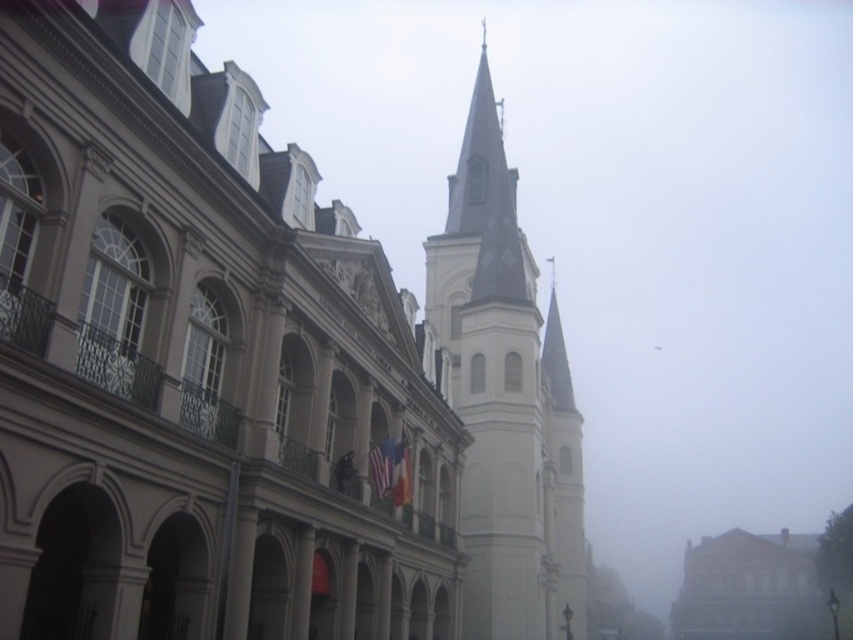
Question: Can you confirm if white stone church at center is smaller than smooth white building at lower right?

Choices:
 (A) yes
 (B) no

Answer: (A)

Question: Does white stone church at center have a smaller size compared to smooth white building at lower right?

Choices:
 (A) yes
 (B) no

Answer: (A)

Question: Based on their relative distances, which object is nearer to the smooth white building at lower right?

Choices:
 (A) white stone church at center
 (B) white stone steeple at center

Answer: (B)

Question: Among these points, which one is farthest from the camera?

Choices:
 (A) (514, 253)
 (B) (100, 337)

Answer: (A)

Question: Is white stone steeple at center thinner than smooth white building at lower right?

Choices:
 (A) yes
 (B) no

Answer: (A)

Question: Which point appears farthest from the camera in this image?

Choices:
 (A) (80, 611)
 (B) (758, 541)
 (C) (527, 563)

Answer: (B)